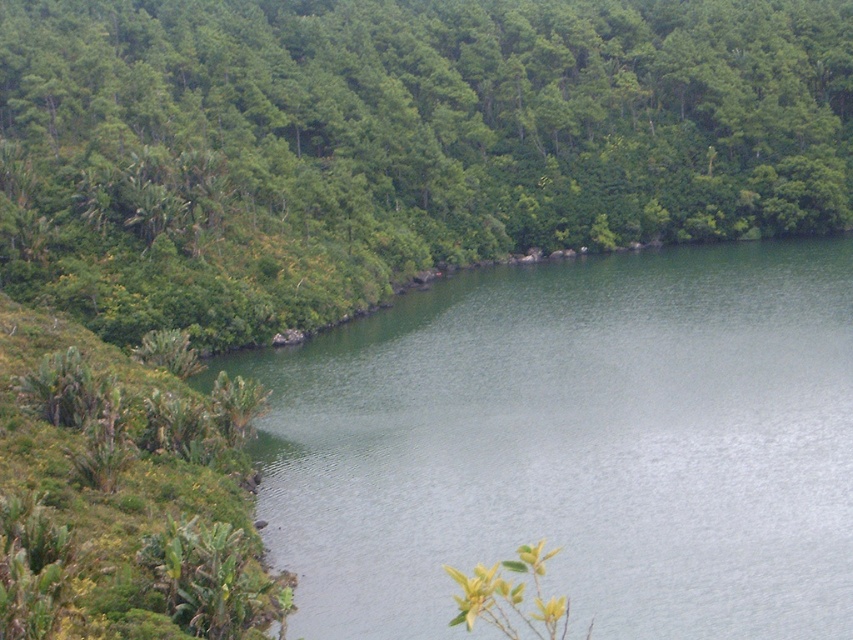
Question: Which of the following is the closest to the observer?

Choices:
 (A) green leafy tree at center
 (B) green smooth water at center
 (C) green leafy vegetation at lower left

Answer: (C)

Question: Does green leafy tree at center have a greater width compared to green smooth water at center?

Choices:
 (A) no
 (B) yes

Answer: (B)

Question: Is green smooth water at center above green leafy vegetation at lower left?

Choices:
 (A) no
 (B) yes

Answer: (B)

Question: Which object appears farthest from the camera in this image?

Choices:
 (A) green smooth water at center
 (B) green leafy tree at center
 (C) green leafy vegetation at lower left

Answer: (B)

Question: Does green leafy tree at center appear on the left side of green smooth water at center?

Choices:
 (A) no
 (B) yes

Answer: (B)

Question: Which object is the closest to the green smooth water at center?

Choices:
 (A) green leafy tree at center
 (B) green leafy vegetation at lower left

Answer: (B)